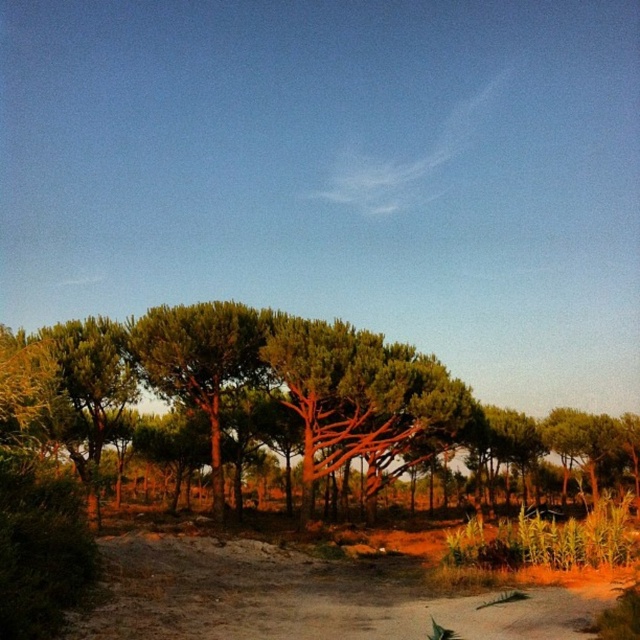
In the serene outdoor scene with pine trees and golden hour lighting, there is a point marked at coordinates (301, 392). What object is located at this point?

The point at coordinates (301, 392) indicates a green leafy tree at left.

You are hiking on a trail and see the green leafy tree at left and the brown sandy dirt track at lower center. Which object is positioned lower in the image?

The green leafy tree at left is located below the brown sandy dirt track at lower center, so the tree is positioned lower in the image.